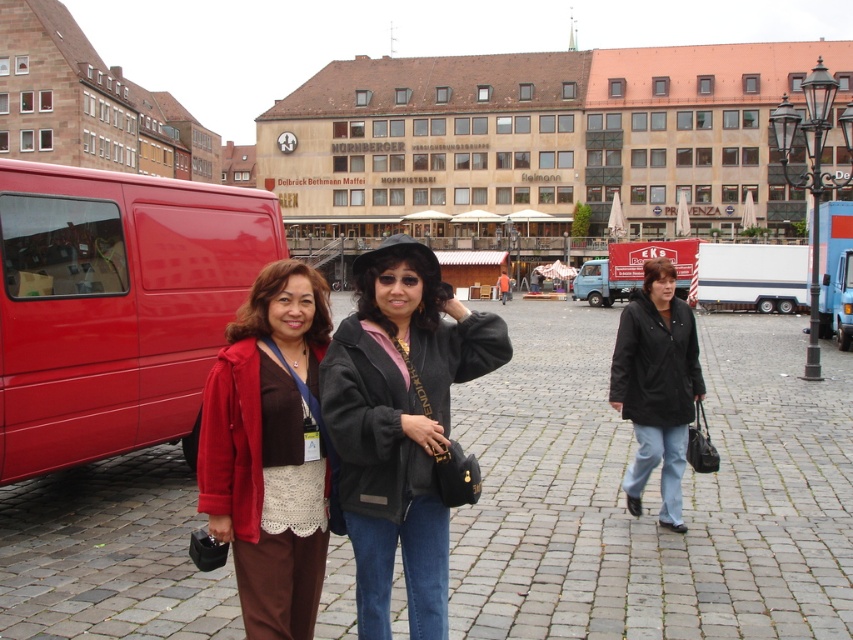
Looking at this image, which is above, matte red van at left or black leather jacket at center?

Positioned higher is matte red van at left.

Locate an element on the screen. matte red van at left is located at coordinates (115, 307).

Who is more forward, (15, 161) or (672, 464)?

Point (15, 161)

Where is `matte red van at left`? The image size is (853, 640). matte red van at left is located at coordinates (115, 307).

Who is shorter, matte red van at left or black fuzzy jacket at center?

Standing shorter between the two is black fuzzy jacket at center.

Can you confirm if matte red van at left is positioned above black fuzzy jacket at center?

Yes.

Which is in front, point (144, 198) or point (350, 464)?

Point (350, 464)

Find the location of `matte red van at left`. matte red van at left is located at coordinates (115, 307).

Is black fuzzy jacket at center further to camera compared to black leather jacket at center?

No.

Who is more distant from viewer, (x=428, y=413) or (x=618, y=339)?

The point (x=618, y=339) is more distant.

What are the coordinates of `black fuzzy jacket at center` in the screenshot? It's located at (399, 424).